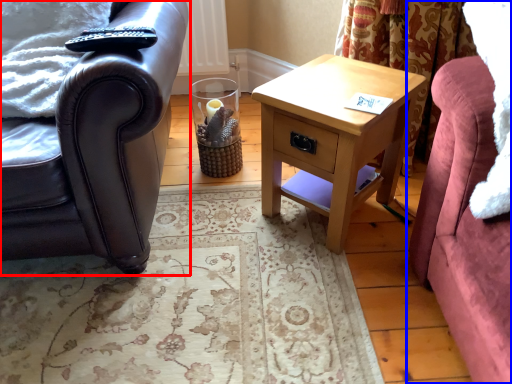
Question: Which object appears closest to the camera in this image, chair (highlighted by a red box) or studio couch (highlighted by a blue box)?

Choices:
 (A) chair
 (B) studio couch

Answer: (B)